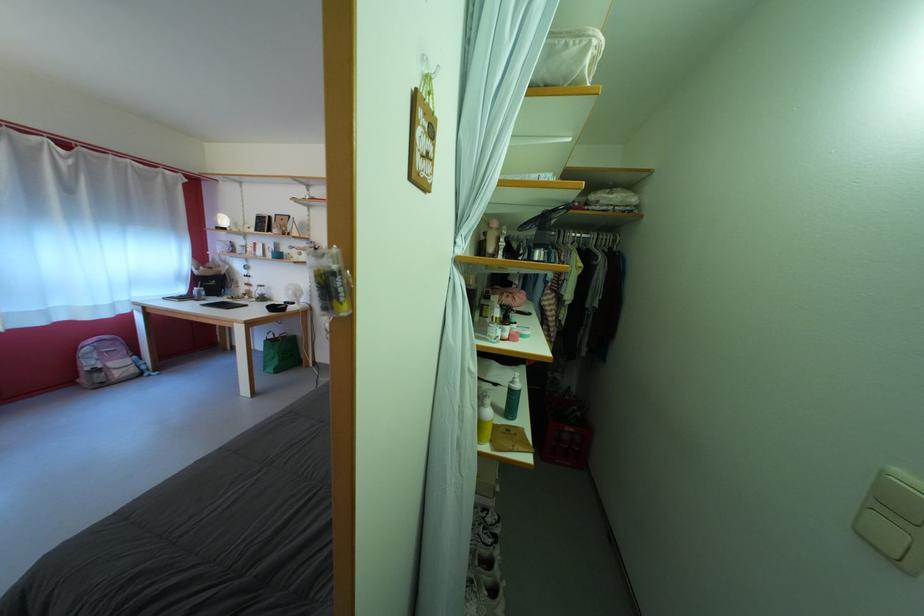
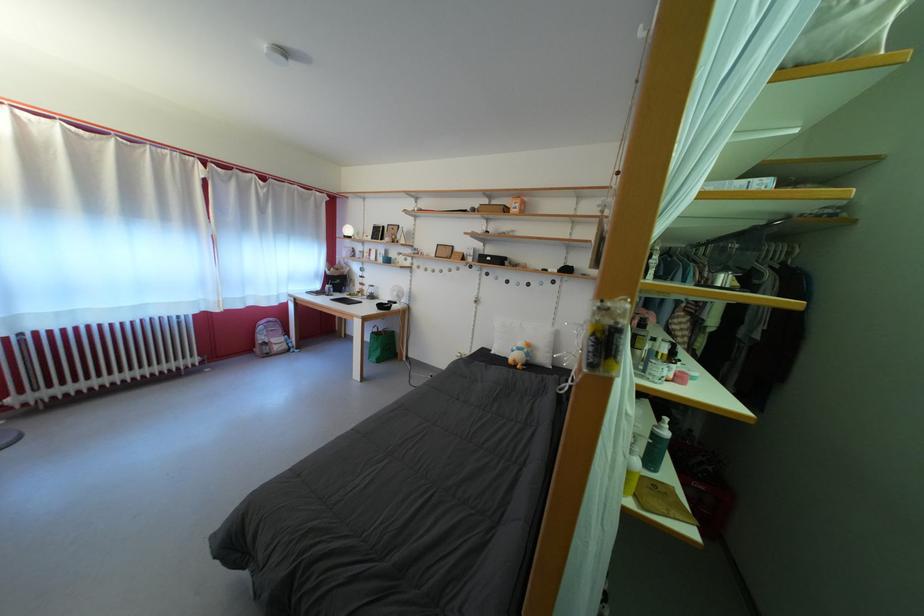
Question: The images are taken continuously from a first-person perspective. In which direction are you moving?

Choices:
 (A) Left
 (B) Right
 (C) Forward
 (D) Backward

Answer: (A)